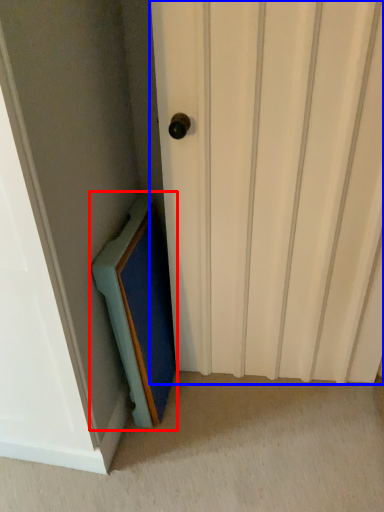
Question: Which object is further to the camera taking this photo, medicine cabinet (highlighted by a red box) or door (highlighted by a blue box)?

Choices:
 (A) medicine cabinet
 (B) door

Answer: (A)